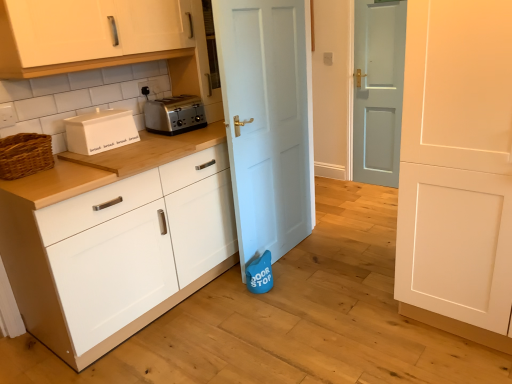
Locate an element on the screen. Image resolution: width=512 pixels, height=384 pixels. vacant area that lies between white matte door at right, marked as the third door in a back-to-front arrangement, and light blue matte door at center, the 2th door positioned from the back is located at coordinates (338, 275).